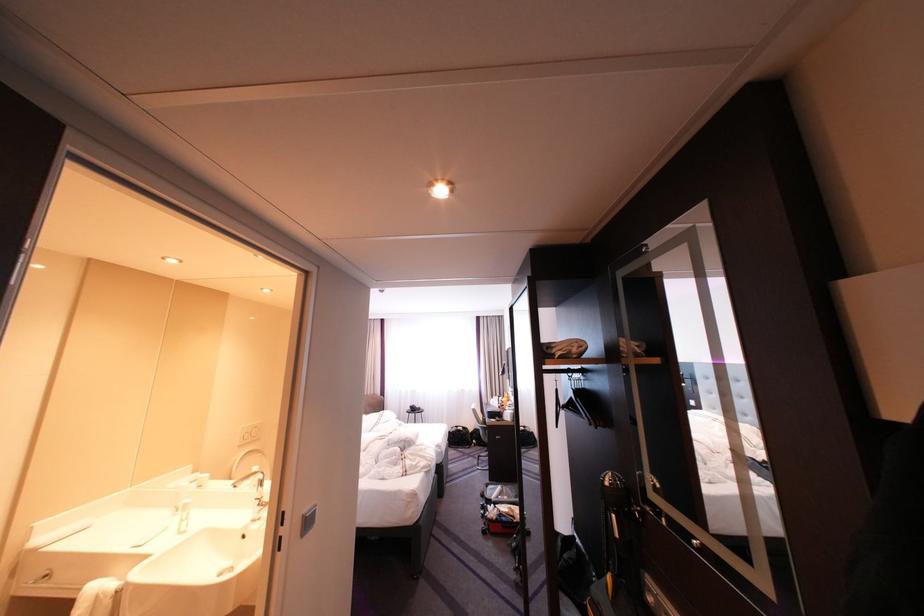
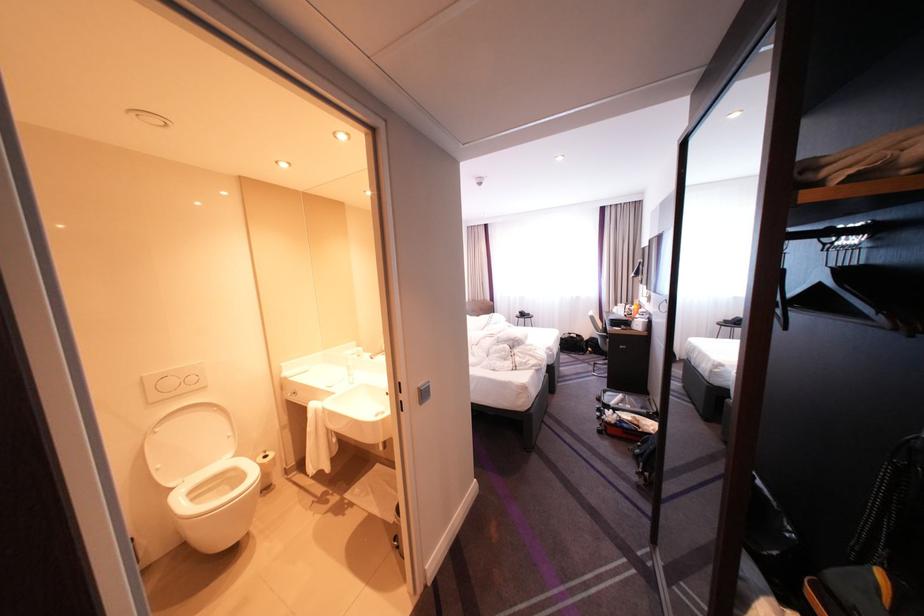
In the second image, find the point that corresponds to (x=512, y=398) in the first image.

(638, 305)